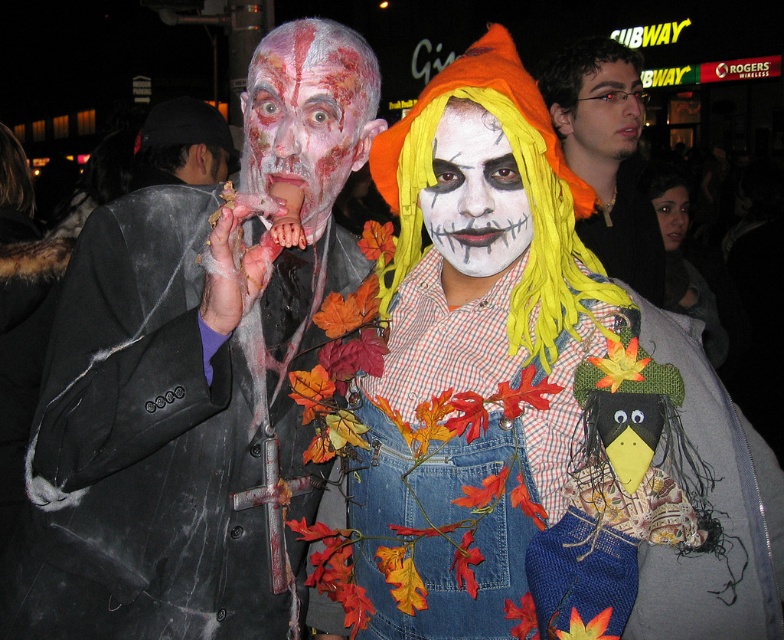
Is matte black hair at upper center closer to the viewer compared to smooth skin face at upper center?

That is True.

What do you see at coordinates (608, 156) in the screenshot?
I see `matte black hair at upper center` at bounding box center [608, 156].

This screenshot has height=640, width=784. I want to click on matte black hair at upper center, so click(x=608, y=156).

You are a GUI agent. You are given a task and a screenshot of the screen. Output one action in this format:
    pyautogui.click(x=<x>, y=<y>)
    Task: Click on the matte black hair at upper center
    The image size is (784, 640).
    Given the screenshot: What is the action you would take?
    pyautogui.click(x=608, y=156)

In the scene shown: Is matte flesh-colored makeup at center to the right of matte black face at center from the viewer's perspective?

Yes, matte flesh-colored makeup at center is to the right of matte black face at center.

Which is behind, point (289, 100) or point (216, 145)?

Point (216, 145)

Where is `matte flesh-colored makeup at center`? matte flesh-colored makeup at center is located at coordinates (307, 118).

Between matte black suit at left and matte black hair at upper center, which one is positioned lower?

matte black suit at left

Between matte black suit at left and matte black hair at upper center, which one appears on the left side from the viewer's perspective?

From the viewer's perspective, matte black suit at left appears more on the left side.

This screenshot has width=784, height=640. I want to click on matte black suit at left, so click(x=194, y=378).

Locate an element on the screen. The height and width of the screenshot is (640, 784). matte black suit at left is located at coordinates (194, 378).